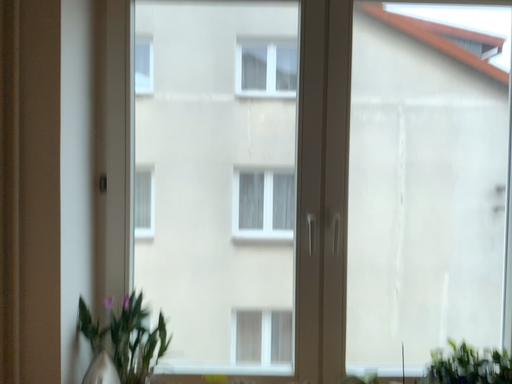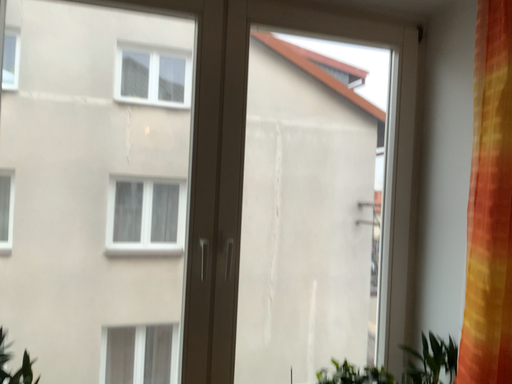
Question: How did the camera likely rotate when shooting the video?

Choices:
 (A) rotated left
 (B) rotated right

Answer: (B)